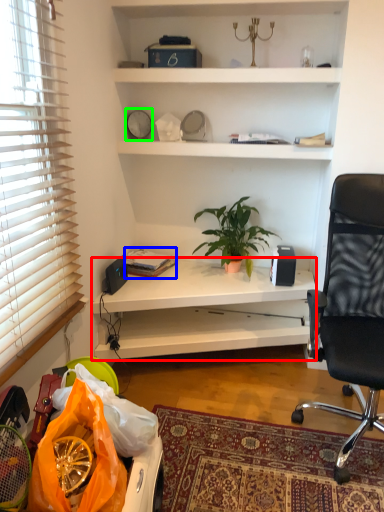
Question: Which is nearer to the desk (highlighted by a red box)? book (highlighted by a blue box) or clock (highlighted by a green box).

Choices:
 (A) book
 (B) clock

Answer: (A)